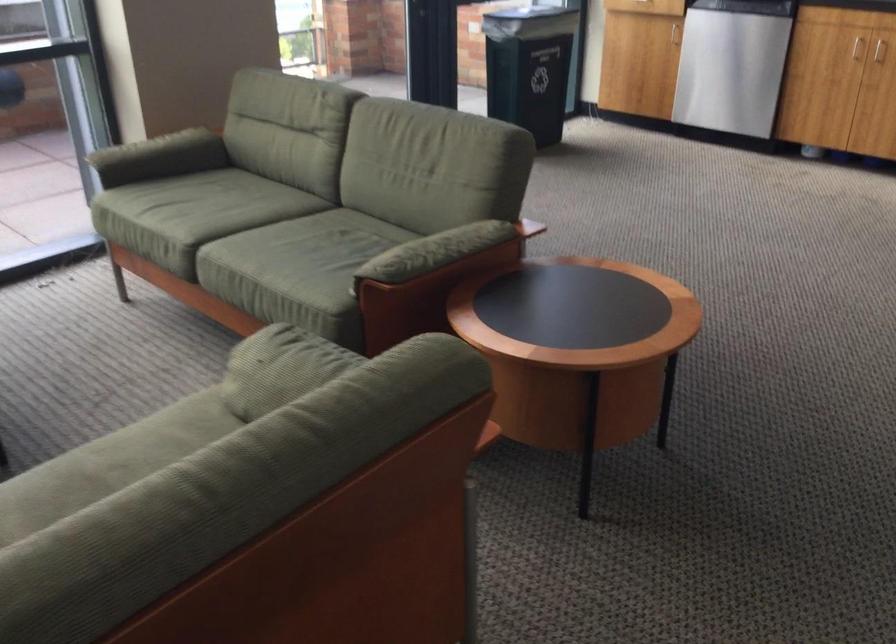
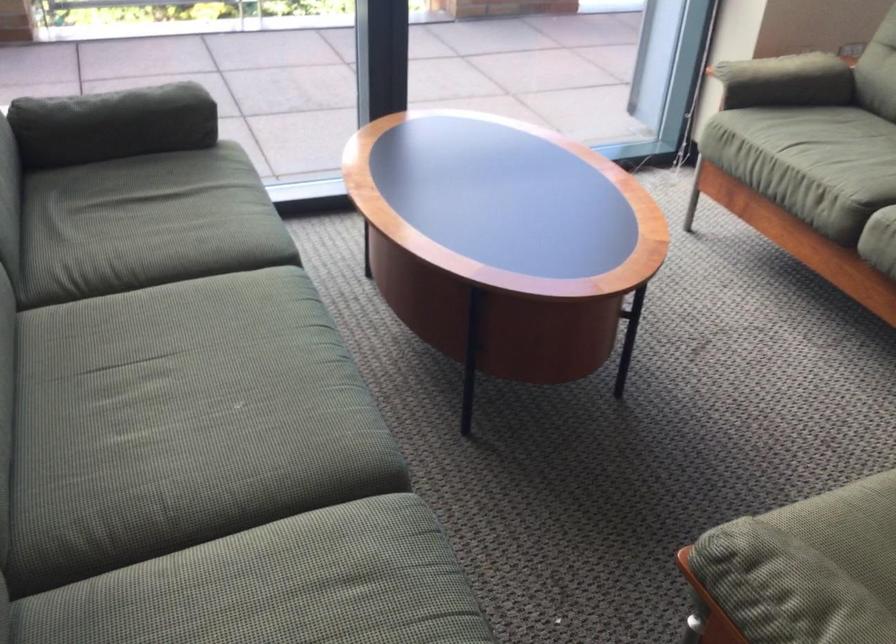
The point at (149,146) is marked in the first image. Where is the corresponding point in the second image?

(773, 68)